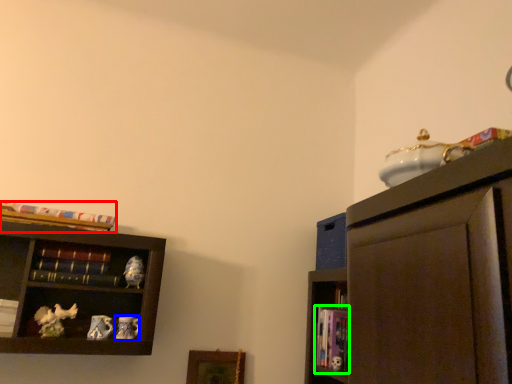
Question: Which object is positioned farthest from book (highlighted by a red box)? Select from toy (highlighted by a blue box) and book (highlighted by a green box).

Choices:
 (A) toy
 (B) book

Answer: (B)